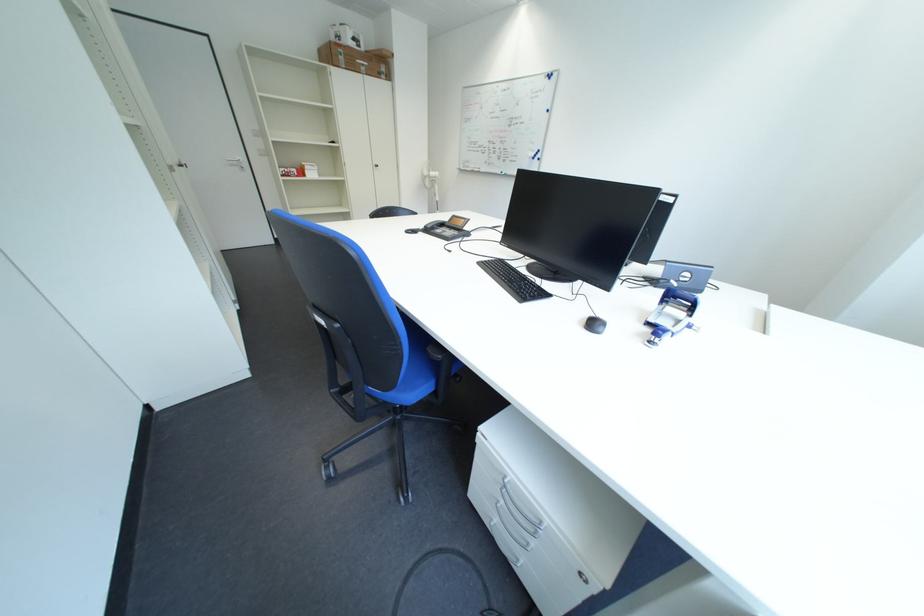
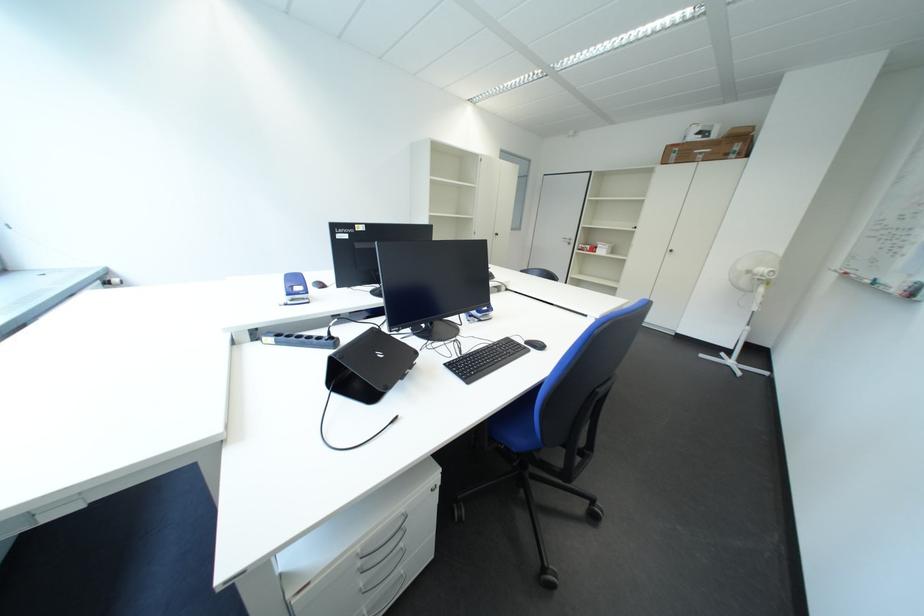
The point at (395, 71) is marked in the first image. Where is the corresponding point in the second image?

(748, 150)